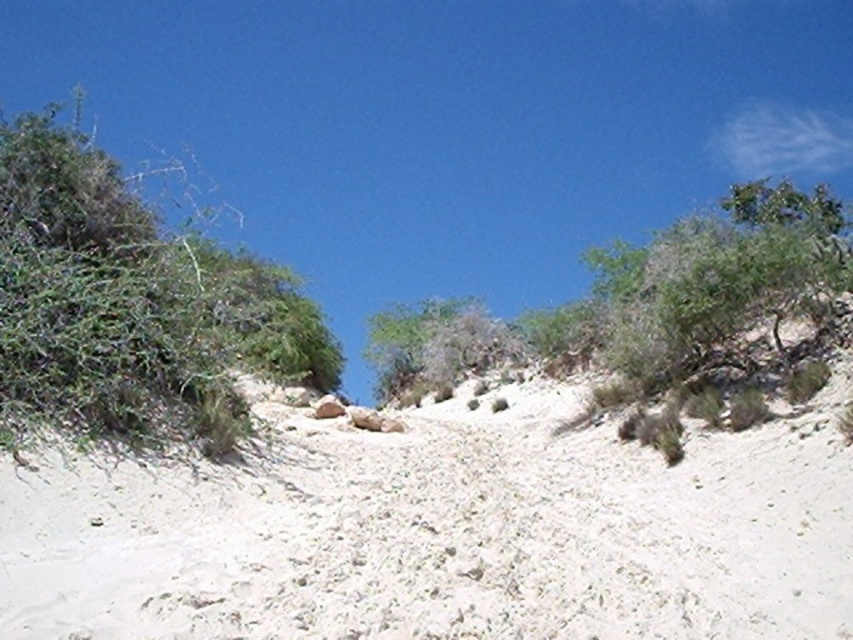
Question: Does white sandy at center appear on the right side of green leafy bush at left?

Choices:
 (A) no
 (B) yes

Answer: (B)

Question: Which object is closer to the camera taking this photo?

Choices:
 (A) green leafy bush at left
 (B) white sandy at center

Answer: (B)

Question: Does white sandy at center have a lesser width compared to green leafy bush at left?

Choices:
 (A) no
 (B) yes

Answer: (A)

Question: Which of the following is the farthest from the observer?

Choices:
 (A) white sandy at center
 (B) green leafy bush at left

Answer: (B)

Question: Is white sandy at center thinner than green leafy bush at left?

Choices:
 (A) yes
 (B) no

Answer: (B)